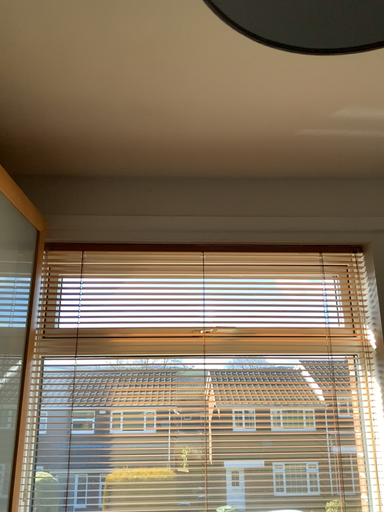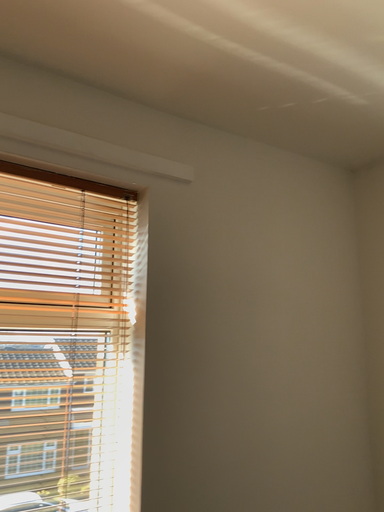
Question: Which way did the camera rotate in the video?

Choices:
 (A) rotated right
 (B) rotated left

Answer: (A)